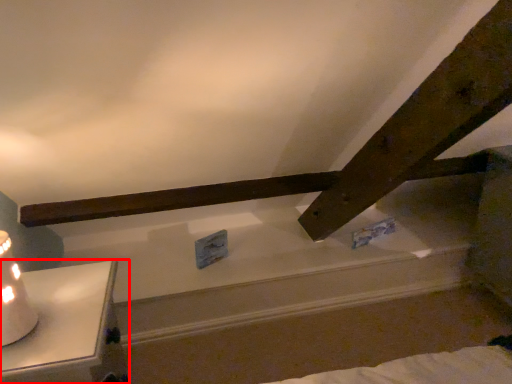
Question: In this image, where is furniture (annotated by the red box) located relative to table lamp?

Choices:
 (A) right
 (B) left

Answer: (A)